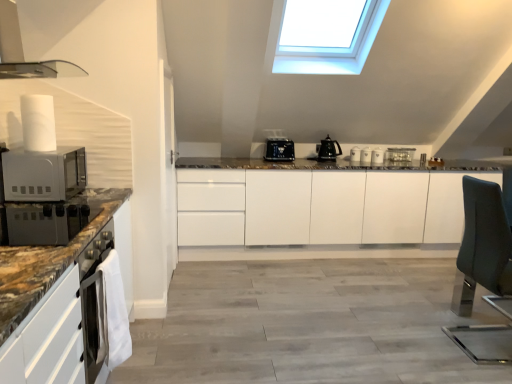
The height and width of the screenshot is (384, 512). Describe the element at coordinates (400, 156) in the screenshot. I see `satin silver toaster at center, which is the 1th appliance in right-to-left order` at that location.

This screenshot has height=384, width=512. What are the coordinates of `black plastic toaster at center, positioned as the 1th kitchen appliance in left-to-right order` in the screenshot? It's located at (279, 150).

What do you see at coordinates (47, 222) in the screenshot? This screenshot has width=512, height=384. I see `matte black microwave at left, the 5th appliance in the right-to-left sequence` at bounding box center [47, 222].

Identify the location of brown marble countertop at left. (48, 261).

How much space does black glossy kettle at center, the 1th kitchen appliance positioned from the right, occupy horizontally?

8.08 inches.

Locate an element on the screen. white glossy mug at upper center, which is counted as the second appliance, starting from the left is located at coordinates (355, 154).

The height and width of the screenshot is (384, 512). Describe the element at coordinates (320, 207) in the screenshot. I see `white glossy cabinetry at center` at that location.

I want to click on satin silver toaster at center, the 1th appliance positioned from the back, so click(x=400, y=156).

At what (x,y) coordinates should I click in order to perform the action: click on swivel chair on the right of sleek metallic range hood at upper left. Please return your answer as a coordinate pair (x, y). Looking at the image, I should click on click(x=468, y=248).

Would you say sleek metallic range hood at upper left is part of teal fabric swivel chair at right's contents?

No, sleek metallic range hood at upper left is not a part of teal fabric swivel chair at right.

Considering the sizes of objects teal fabric swivel chair at right and sleek metallic range hood at upper left in the image provided, who is smaller, teal fabric swivel chair at right or sleek metallic range hood at upper left?

Smaller between the two is sleek metallic range hood at upper left.

Does teal fabric swivel chair at right turn towards black glossy kettle at center, arranged as the second kitchen appliance when viewed from the left?

No, teal fabric swivel chair at right is not facing towards black glossy kettle at center, arranged as the second kitchen appliance when viewed from the left.

Would you say black glossy kettle at center, the 1th kitchen appliance positioned from the right, is part of teal fabric swivel chair at right's contents?

No, black glossy kettle at center, the 1th kitchen appliance positioned from the right, is not a part of teal fabric swivel chair at right.

How many degrees apart are the facing directions of teal fabric swivel chair at right and black glossy kettle at center, arranged as the second kitchen appliance when viewed from the left?

The angular difference between teal fabric swivel chair at right and black glossy kettle at center, arranged as the second kitchen appliance when viewed from the left, is 90.2 degrees.

From the image's perspective, is teal fabric swivel chair at right located above or below black glossy kettle at center, arranged as the second kitchen appliance when viewed from the left?

teal fabric swivel chair at right is below black glossy kettle at center, arranged as the second kitchen appliance when viewed from the left.

Which object is positioned more to the left, teal fabric swivel chair at right or white glossy cabinetry at center?

white glossy cabinetry at center is more to the left.

Based on the photo, between teal fabric swivel chair at right and white glossy cabinetry at center, which one is positioned behind?

white glossy cabinetry at center is more distant.

Can you confirm if teal fabric swivel chair at right is thinner than white glossy cabinetry at center?

Yes, teal fabric swivel chair at right is thinner than white glossy cabinetry at center.

Considering the positions of objects teal fabric swivel chair at right and satin silver toaster at center, which is the 1th appliance in right-to-left order, in the image provided, who is more to the left, teal fabric swivel chair at right or satin silver toaster at center, which is the 1th appliance in right-to-left order,?

teal fabric swivel chair at right.

Between teal fabric swivel chair at right and satin silver toaster at center, which is the 1th appliance in right-to-left order, which one has larger width?

With larger width is teal fabric swivel chair at right.

From the picture: From the image's perspective, does teal fabric swivel chair at right appear lower than satin silver toaster at center, which appears as the fifth appliance when viewed from the left?

Yes, from the image's perspective, teal fabric swivel chair at right is below satin silver toaster at center, which appears as the fifth appliance when viewed from the left.

Is black plastic toaster at center, which appears as the 2th kitchen appliance when viewed from the right, further to camera compared to white glossy coffee cup at center, which is the 3th appliance from right to left?

No, black plastic toaster at center, which appears as the 2th kitchen appliance when viewed from the right, is in front of white glossy coffee cup at center, which is the 3th appliance from right to left.

Does black plastic toaster at center, positioned as the 1th kitchen appliance in left-to-right order, have a lesser width compared to white glossy coffee cup at center, which is the third appliance in left-to-right order?

In fact, black plastic toaster at center, positioned as the 1th kitchen appliance in left-to-right order, might be wider than white glossy coffee cup at center, which is the third appliance in left-to-right order.

Who is taller, black plastic toaster at center, positioned as the 1th kitchen appliance in left-to-right order, or white glossy coffee cup at center, which is the third appliance from back to front?

black plastic toaster at center, positioned as the 1th kitchen appliance in left-to-right order, is taller.

Is black plastic toaster at center, which appears as the 2th kitchen appliance when viewed from the right, directly adjacent to white glossy coffee cup at center, which is the third appliance in left-to-right order?

No, black plastic toaster at center, which appears as the 2th kitchen appliance when viewed from the right, is not touching white glossy coffee cup at center, which is the third appliance in left-to-right order.

Where is `the 1st appliance counting from the left side of the teal fabric swivel chair at right`? The image size is (512, 384). the 1st appliance counting from the left side of the teal fabric swivel chair at right is located at coordinates (377, 156).

What's the angular difference between teal fabric swivel chair at right and white glossy mugs at center, the 4th appliance viewed from the back,'s facing directions?

The angle between the facing direction of teal fabric swivel chair at right and the facing direction of white glossy mugs at center, the 4th appliance viewed from the back, is 90.2 degrees.

Is white glossy mugs at center, positioned as the fourth appliance in left-to-right order, surrounded by teal fabric swivel chair at right?

No, white glossy mugs at center, positioned as the fourth appliance in left-to-right order, is located outside of teal fabric swivel chair at right.

In the scene shown: Is teal fabric swivel chair at right in front of or behind white glossy mugs at center, positioned as the fourth appliance in left-to-right order, in the image?

In the image, teal fabric swivel chair at right appears in front of white glossy mugs at center, positioned as the fourth appliance in left-to-right order.

Is point (29, 239) farther from viewer compared to point (473, 183)?

No, it is not.

Considering the relative sizes of matte black microwave at left, the 5th appliance in the right-to-left sequence, and teal fabric swivel chair at right in the image provided, is matte black microwave at left, the 5th appliance in the right-to-left sequence, taller than teal fabric swivel chair at right?

Incorrect, the height of matte black microwave at left, the 5th appliance in the right-to-left sequence, is not larger of that of teal fabric swivel chair at right.

From the image's perspective, which object appears higher, matte black microwave at left, positioned as the fifth appliance in back-to-front order, or teal fabric swivel chair at right?

matte black microwave at left, positioned as the fifth appliance in back-to-front order, from the image's perspective.

Identify the location of home appliance that appears above the teal fabric swivel chair at right (from the image's perspective). This screenshot has width=512, height=384. (22, 52).

I want to click on swivel chair below the black glossy kettle at center, arranged as the second kitchen appliance when viewed from the left (from the image's perspective), so click(468, 248).

Based on their spatial positions, is teal fabric swivel chair at right or sleek metallic range hood at upper left closer to brown marble countertop at left?

sleek metallic range hood at upper left is closer to brown marble countertop at left.

Estimate the real-world distances between objects in this image. Which object is further from teal fabric swivel chair at right, brown marble countertop at left or white glossy mugs at center, the 4th appliance viewed from the back?

The object further to teal fabric swivel chair at right is brown marble countertop at left.

From the picture: Estimate the real-world distances between objects in this image. Which object is closer to black plastic toaster at center, which appears as the 2th kitchen appliance when viewed from the right, sleek metallic range hood at upper left or white glossy coffee cup at center, which is the third appliance in left-to-right order?

white glossy coffee cup at center, which is the third appliance in left-to-right order, is closer to black plastic toaster at center, which appears as the 2th kitchen appliance when viewed from the right.

When comparing their distances from white glossy cabinetry at center, does black plastic toaster at center, positioned as the 1th kitchen appliance in left-to-right order, or sleek metallic range hood at upper left seem closer?

black plastic toaster at center, positioned as the 1th kitchen appliance in left-to-right order, is closer to white glossy cabinetry at center.

From the image, which object appears to be nearer to matte black microwave at left, positioned as the fifth appliance in back-to-front order, satin silver toaster at center, which is the 1th appliance in right-to-left order, or sleek metallic range hood at upper left?

Based on the image, sleek metallic range hood at upper left appears to be nearer to matte black microwave at left, positioned as the fifth appliance in back-to-front order.

From the image, which object appears to be nearer to black plastic toaster at center, positioned as the 1th kitchen appliance in left-to-right order, sleek metallic range hood at upper left or white matte microwave oven at left?

white matte microwave oven at left is positioned closer to the anchor black plastic toaster at center, positioned as the 1th kitchen appliance in left-to-right order.

When comparing their distances from matte black microwave at left, the 5th appliance in the right-to-left sequence, does sleek metallic range hood at upper left or white glossy coffee cup at center, which is the third appliance from back to front, seem further?

The object further to matte black microwave at left, the 5th appliance in the right-to-left sequence, is white glossy coffee cup at center, which is the third appliance from back to front.

Which object lies further to the anchor point satin silver toaster at center, the 1th appliance positioned from the back, white glossy mugs at center, the 4th appliance viewed from the back, or matte black microwave at left, positioned as the fifth appliance in back-to-front order?

matte black microwave at left, positioned as the fifth appliance in back-to-front order.

Where is `countertop situated between sleek metallic range hood at upper left and teal fabric swivel chair at right from left to right`? Image resolution: width=512 pixels, height=384 pixels. countertop situated between sleek metallic range hood at upper left and teal fabric swivel chair at right from left to right is located at coordinates (48, 261).

Where is `kitchen appliance located between teal fabric swivel chair at right and black glossy kettle at center, the 1th kitchen appliance positioned from the right, in the depth direction`? kitchen appliance located between teal fabric swivel chair at right and black glossy kettle at center, the 1th kitchen appliance positioned from the right, in the depth direction is located at coordinates coord(279,150).

This screenshot has width=512, height=384. I want to click on appliance between brown marble countertop at left and white glossy cabinetry at center from front to back, so click(47, 222).

Locate an element on the screen. cabinetry located between sleek metallic range hood at upper left and white glossy mug at upper center, which is counted as the second appliance, starting from the left, in the depth direction is located at coordinates (320, 207).